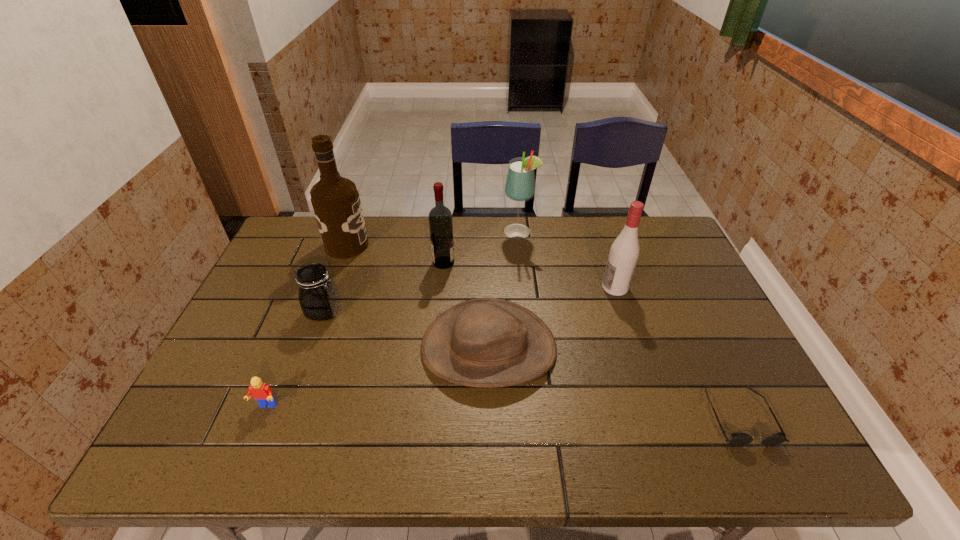
The height and width of the screenshot is (540, 960). Identify the location of alcohol that is at the left edge. (335, 200).

Identify the location of Lego located at the left edge. (261, 392).

Image resolution: width=960 pixels, height=540 pixels. What are the coordinates of `object situated at the right edge` in the screenshot? It's located at (738, 439).

At what (x,y) coordinates should I click in order to perform the action: click on object present at the far left corner. Please return your answer as a coordinate pair (x, y). This screenshot has height=540, width=960. Looking at the image, I should click on (335, 200).

Find the location of a particular element. The image size is (960, 540). object that is at the near right corner is located at coordinates (738, 439).

The width and height of the screenshot is (960, 540). Find the location of `free space at the far edge of the desktop`. free space at the far edge of the desktop is located at coordinates (393, 232).

In order to click on free spot at the near edge of the desktop in this screenshot , I will do `click(342, 437)`.

I want to click on vacant space at the left edge of the desktop, so click(x=245, y=348).

Identify the location of free space at the right edge. (696, 287).

Identify the location of free space at the far left corner of the desktop. This screenshot has height=540, width=960. (311, 227).